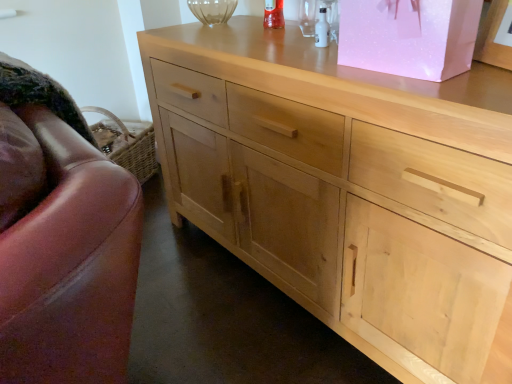
Identify the location of free space to the left of pink paper bag at upper right. The image size is (512, 384). (307, 70).